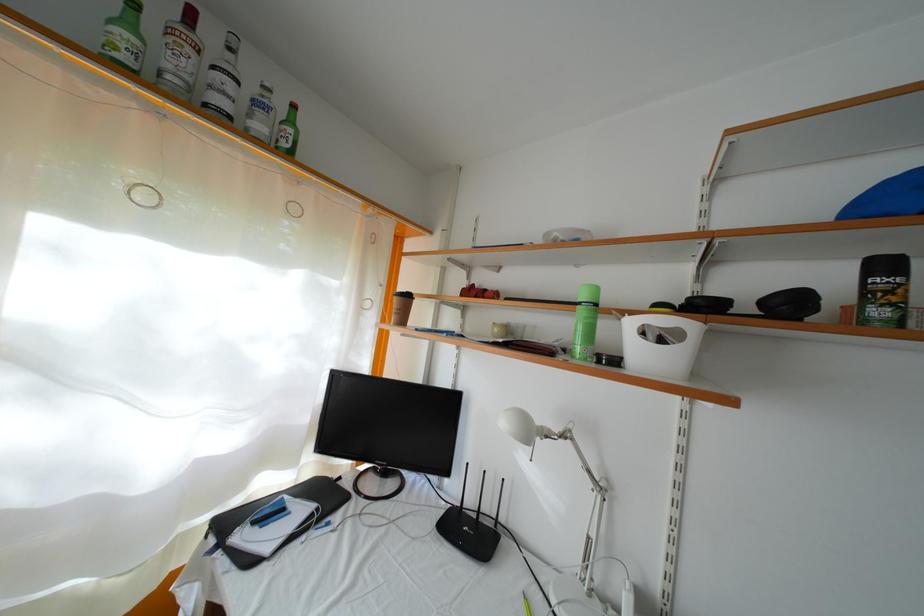
The location [526,604] corresponds to which object?

This point indicates the yellow pen.